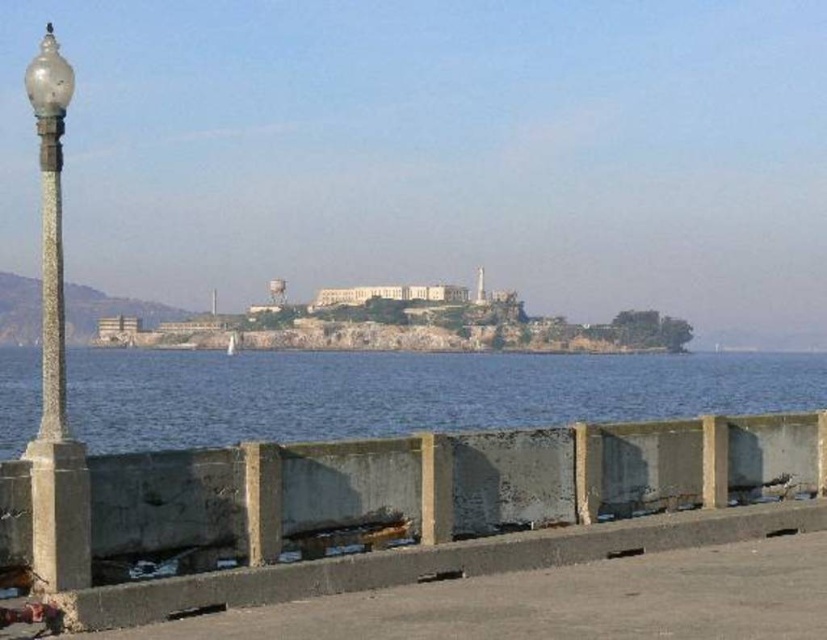
Between blue water at lower center and matte glass lamp post at left, which one has less height?

matte glass lamp post at left

Is blue water at lower center above matte glass lamp post at left?

Incorrect, blue water at lower center is not positioned above matte glass lamp post at left.

Who is more forward, (12, 420) or (58, 140)?

Positioned in front is point (58, 140).

Where is `blue water at lower center`? This screenshot has width=827, height=640. blue water at lower center is located at coordinates (409, 392).

From the picture: Is concrete at lower center positioned behind matte glass lamp post at left?

Yes, it is.

The height and width of the screenshot is (640, 827). Describe the element at coordinates (443, 570) in the screenshot. I see `concrete at lower center` at that location.

Which is in front, point (719, 548) or point (58, 104)?

Point (58, 104)

Identify the location of concrete at lower center. point(443,570).

Does blue water at lower center have a lesser height compared to concrete at lower center?

In fact, blue water at lower center may be taller than concrete at lower center.

Is blue water at lower center positioned in front of concrete at lower center?

Yes, blue water at lower center is closer to the viewer.

Locate an element on the screen. blue water at lower center is located at coordinates (409, 392).